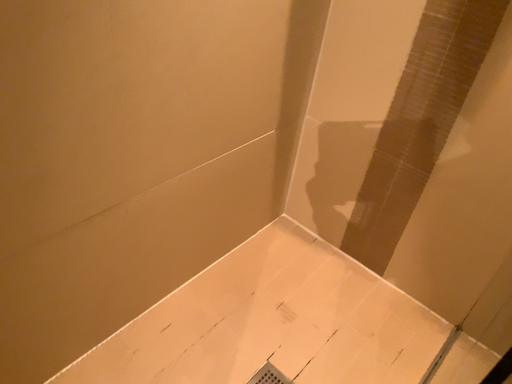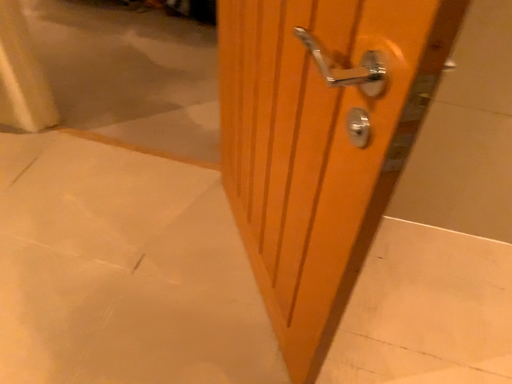
Question: How did the camera likely rotate when shooting the video?

Choices:
 (A) rotated right
 (B) rotated left

Answer: (B)